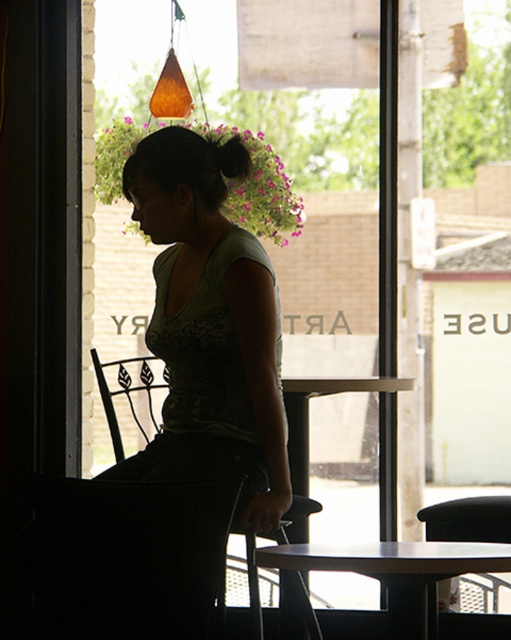
Who is higher up, transparent glass door at center or metallic black chair at left?

transparent glass door at center

Does transparent glass door at center have a smaller size compared to metallic black chair at left?

Correct, transparent glass door at center occupies less space than metallic black chair at left.

Which is behind, point (155, 193) or point (158, 426)?

The point (158, 426) is more distant.

This screenshot has width=511, height=640. I want to click on transparent glass door at center, so point(261,381).

Does metallic black chair at left appear under black silky hair at upper center?

Yes.

What do you see at coordinates (127, 394) in the screenshot? This screenshot has width=511, height=640. I see `metallic black chair at left` at bounding box center [127, 394].

Image resolution: width=511 pixels, height=640 pixels. In order to click on metallic black chair at left in this screenshot , I will do `click(127, 394)`.

This screenshot has width=511, height=640. I want to click on metallic black chair at left, so click(x=127, y=394).

Is point (407, 588) farther from viewer compared to point (419, 518)?

No, (407, 588) is closer to viewer.

Is point (425, 592) farther from camera compared to point (493, 532)?

No, (425, 592) is in front of (493, 532).

Locate an element on the screen. smooth white table at center is located at coordinates (396, 572).